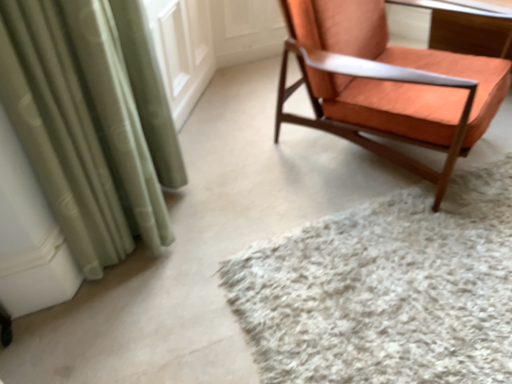
Question: Does wooden table at upper right have a larger size compared to white shaggy rug at center?

Choices:
 (A) no
 (B) yes

Answer: (B)

Question: Is wooden table at upper right to the right of white shaggy rug at center from the viewer's perspective?

Choices:
 (A) yes
 (B) no

Answer: (A)

Question: Does wooden table at upper right have a greater width compared to white shaggy rug at center?

Choices:
 (A) yes
 (B) no

Answer: (B)

Question: Is wooden table at upper right not inside white shaggy rug at center?

Choices:
 (A) yes
 (B) no

Answer: (A)

Question: Is wooden table at upper right looking in the opposite direction of white shaggy rug at center?

Choices:
 (A) no
 (B) yes

Answer: (A)

Question: Does wooden table at upper right have a greater height compared to white shaggy rug at center?

Choices:
 (A) yes
 (B) no

Answer: (A)

Question: Is orange fabric chair at upper right not near white shaggy rug at center?

Choices:
 (A) no
 (B) yes

Answer: (A)

Question: Is orange fabric chair at upper right taller than white shaggy rug at center?

Choices:
 (A) no
 (B) yes

Answer: (B)

Question: Can you confirm if orange fabric chair at upper right is bigger than white shaggy rug at center?

Choices:
 (A) no
 (B) yes

Answer: (B)

Question: Is the position of orange fabric chair at upper right more distant than that of white shaggy rug at center?

Choices:
 (A) no
 (B) yes

Answer: (B)

Question: Is the depth of orange fabric chair at upper right less than that of white shaggy rug at center?

Choices:
 (A) yes
 (B) no

Answer: (B)

Question: From the image's perspective, is orange fabric chair at upper right under white shaggy rug at center?

Choices:
 (A) yes
 (B) no

Answer: (B)

Question: Is orange fabric chair at upper right at the right side of wooden table at upper right?

Choices:
 (A) no
 (B) yes

Answer: (A)